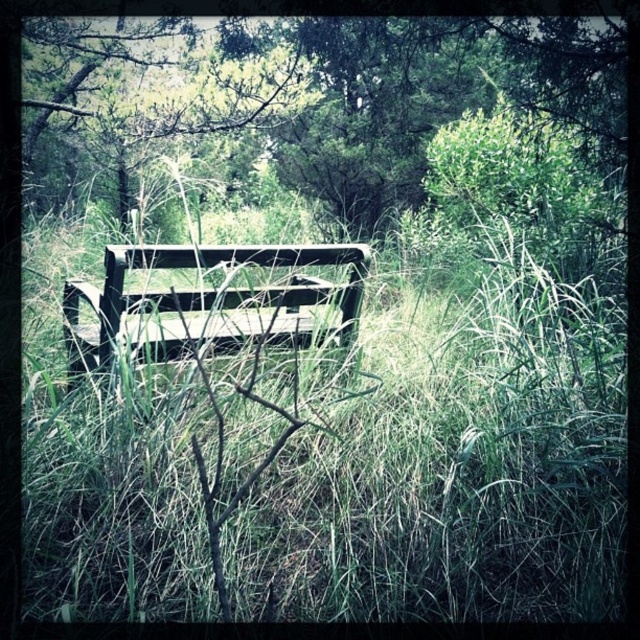
You are planning to sit on one of the benches in the scene. Which bench, the green matte bench at center or the wooden park bench at center, would allow you to sit with more space between your legs?

The green matte bench at center is wider than the wooden park bench at center, so it would provide more space between your legs.

You are standing in the overgrown area and want to place a small flag at the point closer to you. Which point should you choose between point (376, 134) and point (252, 298)?

Point (252, 298) is closer to you, so you should place the flag there.

You are standing at the camera position looking at the scene. There is a point marked at coordinates point (508,77). Can you reach this point without moving your feet?

The point (508,77) is 6.64 meters away from the camera, so you can reach it without moving your feet since it is within arm reach.